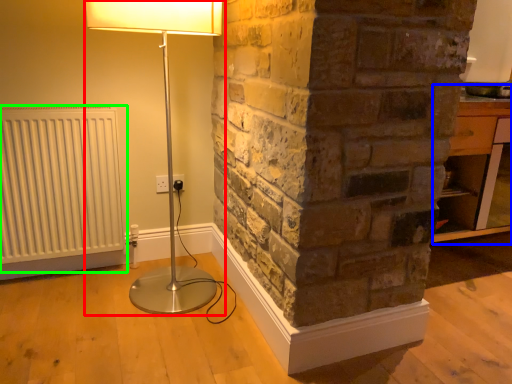
Question: Considering the real-world distances, which object is closest to lamp (highlighted by a red box)? table (highlighted by a blue box) or radiator (highlighted by a green box).

Choices:
 (A) table
 (B) radiator

Answer: (B)